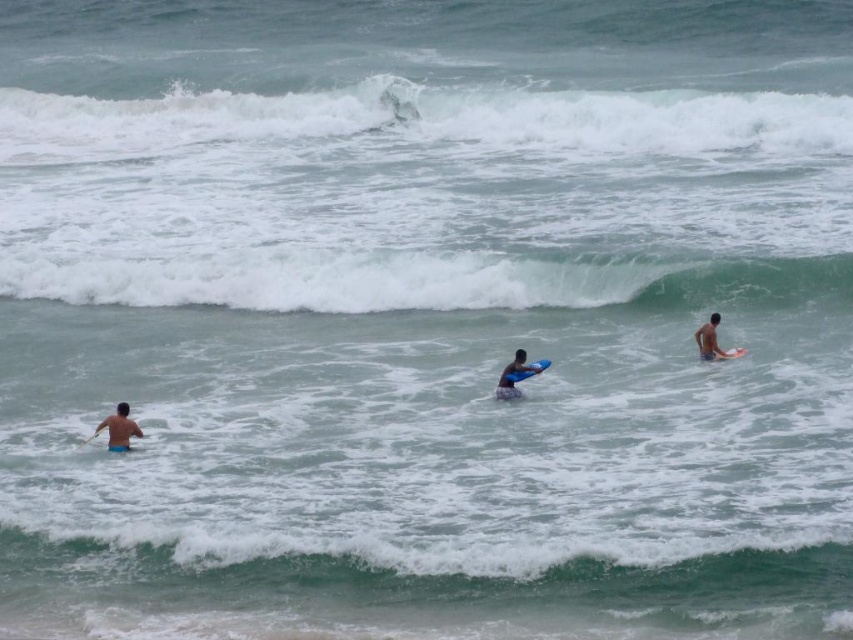
Question: Which object is closer to the camera taking this photo?

Choices:
 (A) blue foam surfboard at center
 (B) skinny man at left

Answer: (B)

Question: Is green smooth wave at center above skinny man at left?

Choices:
 (A) yes
 (B) no

Answer: (A)

Question: Is green smooth wave at center smaller than brown skin at upper right?

Choices:
 (A) yes
 (B) no

Answer: (B)

Question: Which of the following is the closest to the observer?

Choices:
 (A) blue matte surfboard at center
 (B) green smooth wave at center
 (C) white frothy wave at upper center

Answer: (A)

Question: Among these points, which one is nearest to the camera?

Choices:
 (A) (495, 394)
 (B) (830, 134)
 (C) (518, 378)
 (D) (688, 308)

Answer: (C)

Question: Can you confirm if white frothy wave at upper center is positioned below brown skin at upper right?

Choices:
 (A) no
 (B) yes

Answer: (A)